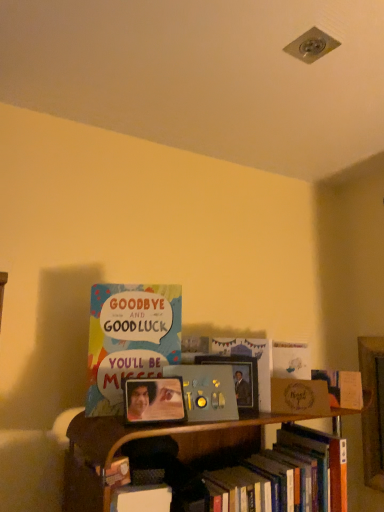
Question: Is multicolored paper card at center, positioned as the first book in top-to-bottom order, turned away from white matte card at upper center, placed as the 4th book when sorted from bottom to top?

Choices:
 (A) no
 (B) yes

Answer: (A)

Question: Can you confirm if multicolored paper card at center, marked as the fifth book in a bottom-to-top arrangement, is taller than white matte card at upper center, placed as the 4th book when sorted from bottom to top?

Choices:
 (A) no
 (B) yes

Answer: (B)

Question: Is multicolored paper card at center, marked as the fifth book in a bottom-to-top arrangement, shorter than white matte card at upper center, which ranks as the second book in top-to-bottom order?

Choices:
 (A) no
 (B) yes

Answer: (A)

Question: Does multicolored paper card at center, positioned as the first book in top-to-bottom order, appear on the left side of white matte card at upper center, which ranks as the second book in top-to-bottom order?

Choices:
 (A) yes
 (B) no

Answer: (A)

Question: From the image's perspective, is multicolored paper card at center, marked as the fifth book in a bottom-to-top arrangement, on white matte card at upper center, which ranks as the second book in top-to-bottom order?

Choices:
 (A) yes
 (B) no

Answer: (A)

Question: Is multicolored paper card at center, positioned as the first book in top-to-bottom order, not close to white matte card at upper center, which ranks as the second book in top-to-bottom order?

Choices:
 (A) yes
 (B) no

Answer: (B)

Question: Considering the relative positions of hardcover book at lower right, the fifth book positioned from the top, and multicolored paper card at center, marked as the fifth book in a bottom-to-top arrangement, in the image provided, is hardcover book at lower right, the fifth book positioned from the top, behind multicolored paper card at center, marked as the fifth book in a bottom-to-top arrangement,?

Choices:
 (A) yes
 (B) no

Answer: (B)

Question: Does hardcover book at lower right, the fifth book positioned from the top, appear on the right side of multicolored paper card at center, positioned as the first book in top-to-bottom order?

Choices:
 (A) yes
 (B) no

Answer: (A)

Question: Is hardcover book at lower right, the fifth book positioned from the top, bigger than multicolored paper card at center, marked as the fifth book in a bottom-to-top arrangement?

Choices:
 (A) yes
 (B) no

Answer: (A)

Question: Is hardcover book at lower right, the fifth book positioned from the top, outside of multicolored paper card at center, positioned as the first book in top-to-bottom order?

Choices:
 (A) yes
 (B) no

Answer: (A)

Question: From the image's perspective, is hardcover book at lower right, the 1th book from the bottom, over multicolored paper card at center, positioned as the first book in top-to-bottom order?

Choices:
 (A) no
 (B) yes

Answer: (A)

Question: Is hardcover book at lower right, the fifth book positioned from the top, far away from multicolored paper card at center, positioned as the first book in top-to-bottom order?

Choices:
 (A) yes
 (B) no

Answer: (B)

Question: Is matte wooden picture frame at center facing away from matte gold card at right?

Choices:
 (A) yes
 (B) no

Answer: (B)